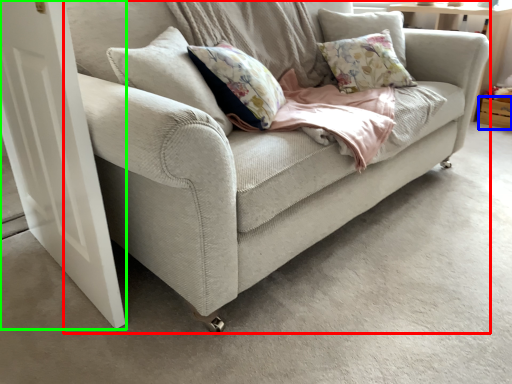
Question: Estimate the real-world distances between objects in this image. Which object is farther from studio couch (highlighted by a red box), drawer (highlighted by a blue box) or screen door (highlighted by a green box)?

Choices:
 (A) drawer
 (B) screen door

Answer: (A)